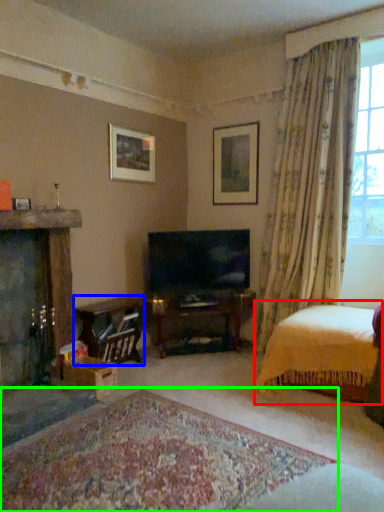
Question: Which object is positioned closest to bed (highlighted by a red box)? Select from table (highlighted by a blue box) and plain (highlighted by a green box).

Choices:
 (A) table
 (B) plain

Answer: (B)